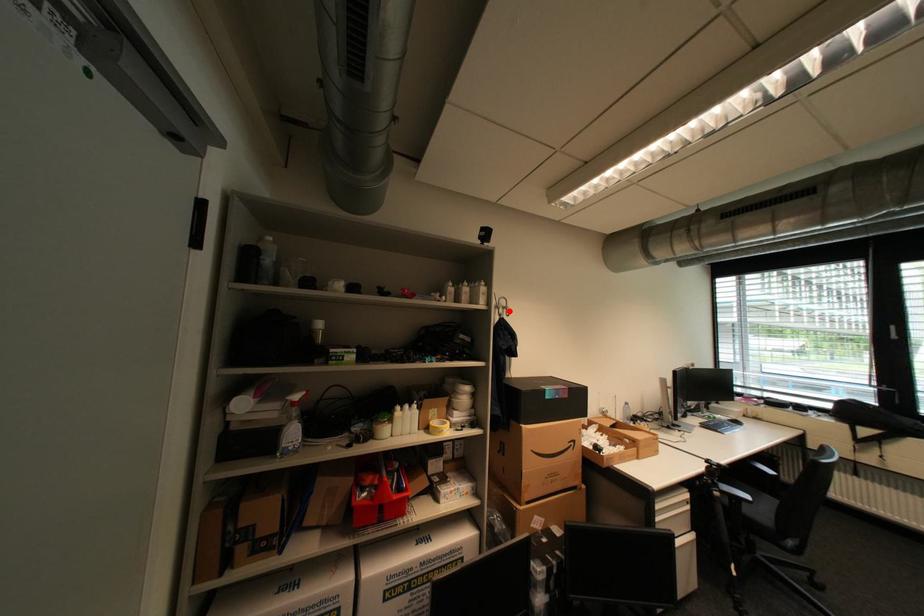
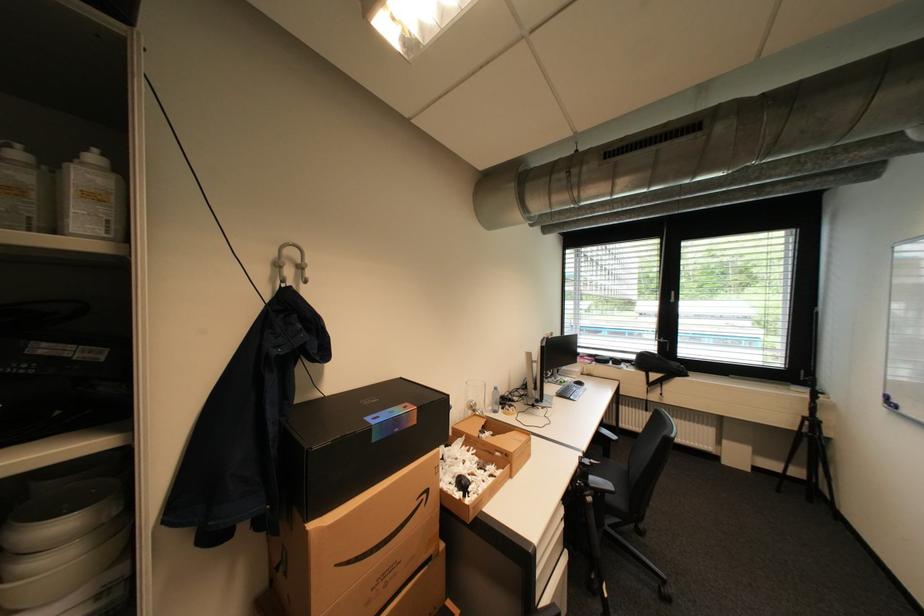
The point at the highlighted location is marked in the first image. Where is the corresponding point in the second image?

(297, 272)